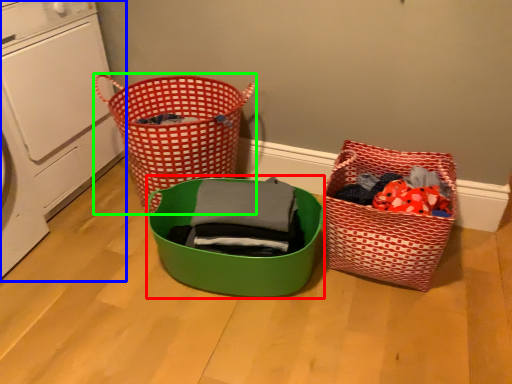
Question: Which is nearer to the basket (highlighted by a red box)? washing machine (highlighted by a blue box) or waste container (highlighted by a green box).

Choices:
 (A) washing machine
 (B) waste container

Answer: (B)